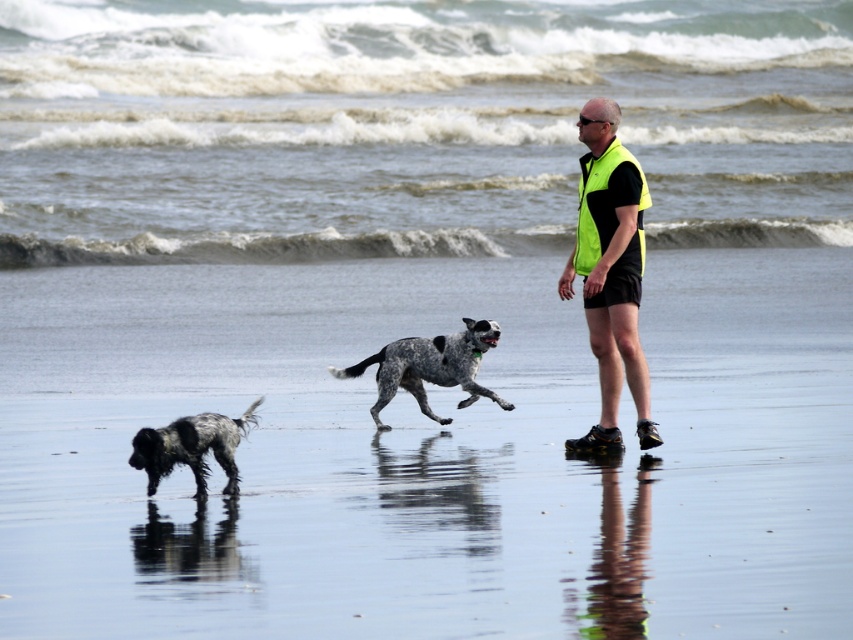
Question: Estimate the real-world distances between objects in this image. Which object is closer to the shiny wet sand at center?

Choices:
 (A) neon yellow vest at center
 (B) spotted fur dog at lower left
 (C) speckled fur dog at center

Answer: (C)

Question: Does speckled fur dog at center have a greater width compared to spotted fur dog at lower left?

Choices:
 (A) no
 (B) yes

Answer: (B)

Question: Which of the following is the farthest from the observer?

Choices:
 (A) (466, 397)
 (B) (219, 461)
 (C) (126, 376)

Answer: (C)

Question: Which of the following is the closest to the observer?

Choices:
 (A) (604, 326)
 (B) (190, 417)

Answer: (B)

Question: Observing the image, what is the correct spatial positioning of shiny wet sand at center in reference to spotted fur dog at lower left?

Choices:
 (A) right
 (B) left

Answer: (A)

Question: Can you confirm if neon yellow vest at center is positioned below speckled fur dog at center?

Choices:
 (A) no
 (B) yes

Answer: (A)